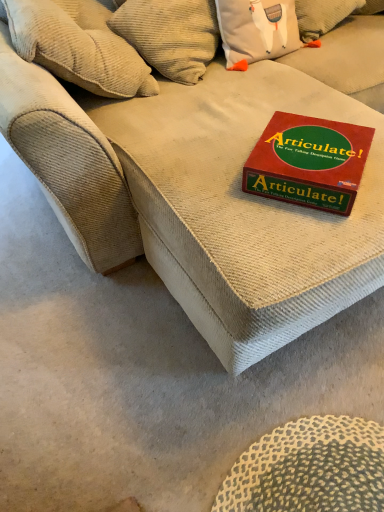
Question: Considering the relative sizes of red cardboard game box at center and beige corduroy couch at center in the image provided, is red cardboard game box at center taller than beige corduroy couch at center?

Choices:
 (A) no
 (B) yes

Answer: (A)

Question: Is red cardboard game box at center in front of beige corduroy couch at center?

Choices:
 (A) no
 (B) yes

Answer: (A)

Question: Are red cardboard game box at center and beige corduroy couch at center located far from each other?

Choices:
 (A) yes
 (B) no

Answer: (B)

Question: Can we say red cardboard game box at center lies outside beige corduroy couch at center?

Choices:
 (A) no
 (B) yes

Answer: (A)

Question: Can you see red cardboard game box at center touching beige corduroy couch at center?

Choices:
 (A) no
 (B) yes

Answer: (A)

Question: From a real-world perspective, does red cardboard game box at center stand above beige corduroy couch at center?

Choices:
 (A) yes
 (B) no

Answer: (B)

Question: Is red cardboard game box at center at the right side of beige corduroy pillow at upper left?

Choices:
 (A) no
 (B) yes

Answer: (B)

Question: Does red cardboard game box at center turn towards beige corduroy pillow at upper left?

Choices:
 (A) no
 (B) yes

Answer: (A)

Question: Considering the relative sizes of red cardboard game box at center and beige corduroy pillow at upper left in the image provided, is red cardboard game box at center wider than beige corduroy pillow at upper left?

Choices:
 (A) yes
 (B) no

Answer: (B)

Question: Is the position of red cardboard game box at center less distant than that of beige corduroy pillow at upper left?

Choices:
 (A) yes
 (B) no

Answer: (A)

Question: Can you confirm if red cardboard game box at center is smaller than beige corduroy pillow at upper left?

Choices:
 (A) no
 (B) yes

Answer: (B)

Question: Are red cardboard game box at center and beige corduroy pillow at upper left located far from each other?

Choices:
 (A) no
 (B) yes

Answer: (A)

Question: Does beige corduroy couch at center turn towards red cardboard game box at center?

Choices:
 (A) no
 (B) yes

Answer: (B)